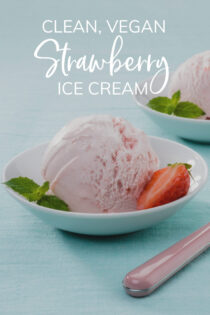
Where is `table`? This screenshot has width=210, height=315. table is located at coordinates (107, 261).